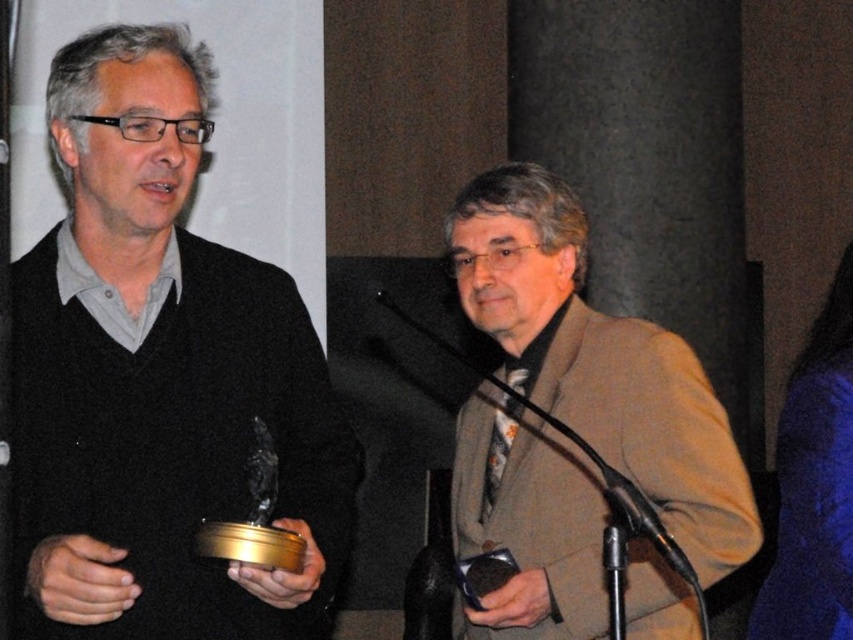
In the scene shown: Is matte black sweater at left positioned before black metallic microphone at center?

That is True.

The height and width of the screenshot is (640, 853). Describe the element at coordinates (158, 378) in the screenshot. I see `matte black sweater at left` at that location.

Locate an element on the screen. matte black sweater at left is located at coordinates click(158, 378).

Between matte black sweater at left and blue fuzzy sweater at right, which one appears on the left side from the viewer's perspective?

matte black sweater at left is more to the left.

From the picture: Does matte black sweater at left have a smaller size compared to blue fuzzy sweater at right?

Incorrect, matte black sweater at left is not smaller in size than blue fuzzy sweater at right.

Is point (239, 316) closer to camera compared to point (820, 588)?

Yes, point (239, 316) is closer to viewer.

You are a GUI agent. You are given a task and a screenshot of the screen. Output one action in this format:
    pyautogui.click(x=<x>, y=<y>)
    Task: Click on the matte black sweater at left
    Image resolution: width=853 pixels, height=640 pixels.
    Given the screenshot: What is the action you would take?
    pyautogui.click(x=158, y=378)

Does point (770, 637) come in front of point (654, 541)?

No, it is not.

Between blue fuzzy sweater at right and black metallic microphone at center, which one has less height?

black metallic microphone at center

Is point (813, 506) positioned in front of point (503, 404)?

No, it is behind (503, 404).

Find the location of a particular element. This screenshot has height=640, width=853. blue fuzzy sweater at right is located at coordinates tap(814, 484).